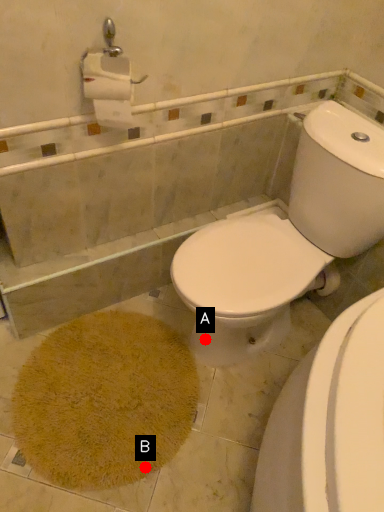
Question: Two points are circled on the image, labeled by A and B beside each circle. Which point is further to the camera?

Choices:
 (A) A is further
 (B) B is further

Answer: (A)